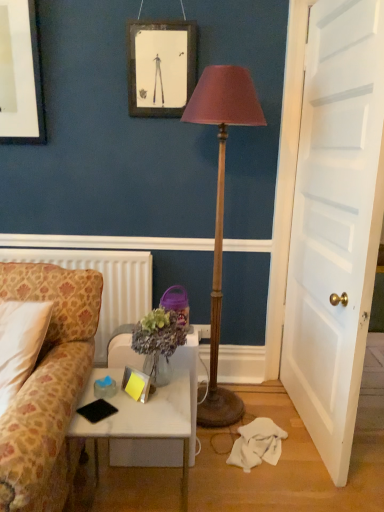
The width and height of the screenshot is (384, 512). Identify the location of free location to the right of wooden floor lamp at center. (263, 404).